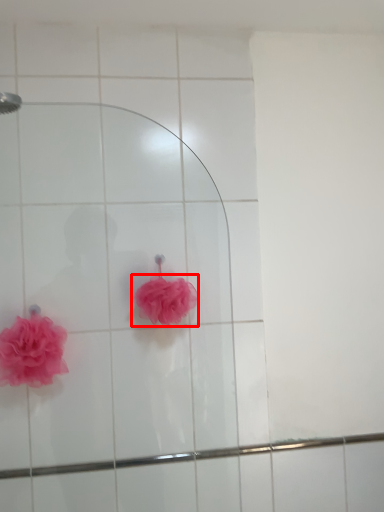
Question: From the image's perspective, where is flower (annotated by the red box) located relative to flower?

Choices:
 (A) below
 (B) above

Answer: (B)